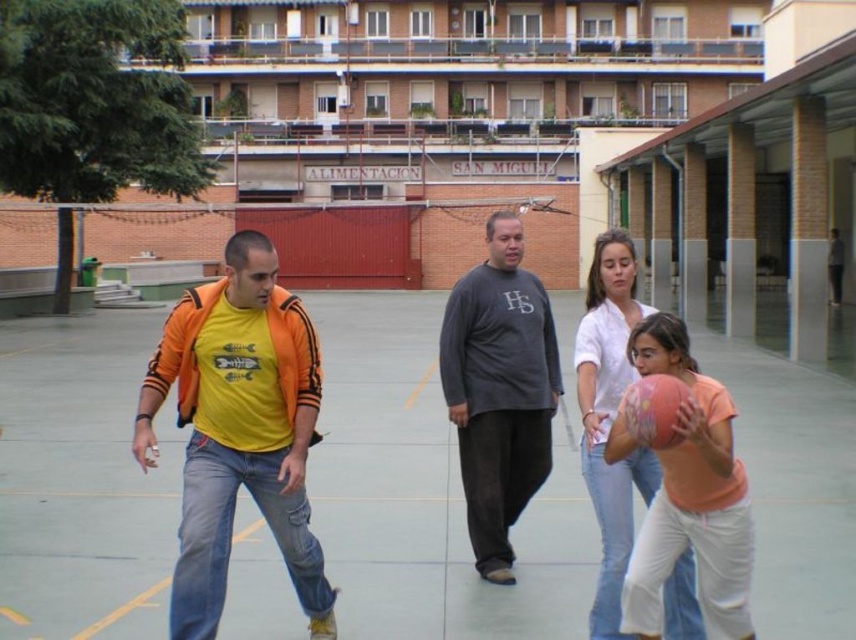
You are a spectator standing at the edge of the basketball court. You want to throw a paper airplane to reach the rubber basketball at center without it going past the basketball. Considering the distance, can you do it if your paper airplane can fly up to 15 feet?

The rubber basketball at center is 15.20 feet away from the viewer. Since the paper airplane can only fly up to 15 feet, it cannot reach the basketball without going past it.

In the basketball court scene, there are a rubber basketball at center and a white cotton shirt at center. Which object is smaller in size?

The rubber basketball at center has a smaller size compared to the white cotton shirt at center.